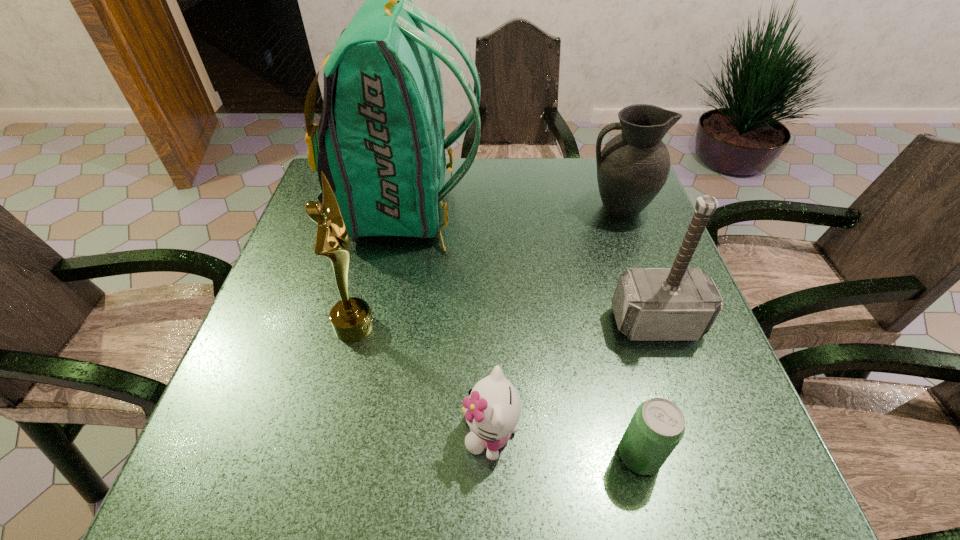
I want to click on free space at the right edge of the desktop, so click(x=681, y=363).

Locate an element on the screen. Image resolution: width=960 pixels, height=540 pixels. vacant space at the far right corner is located at coordinates (583, 174).

Identify the location of free region at the near right corner of the desktop. The width and height of the screenshot is (960, 540). [x=741, y=483].

Find the location of a particular element. This screenshot has height=540, width=960. vacant area between the hammer and the pitcher is located at coordinates 637,266.

Find the location of a particular element. free spot between the kitten and the hammer is located at coordinates (573, 377).

Identify the location of free space between the kitten and the hammer. tap(573, 377).

Identify the location of free space that is in between the hammer and the soda. tap(648, 389).

At what (x,y) coordinates should I click in order to perform the action: click on empty space that is in between the backpack and the award. Please return your answer as a coordinate pair (x, y). The height and width of the screenshot is (540, 960). Looking at the image, I should click on (379, 267).

The height and width of the screenshot is (540, 960). What are the coordinates of `free space that is in between the award and the kitten` in the screenshot? It's located at (422, 379).

Where is `empty space that is in between the award and the kitten`? empty space that is in between the award and the kitten is located at coordinates (422, 379).